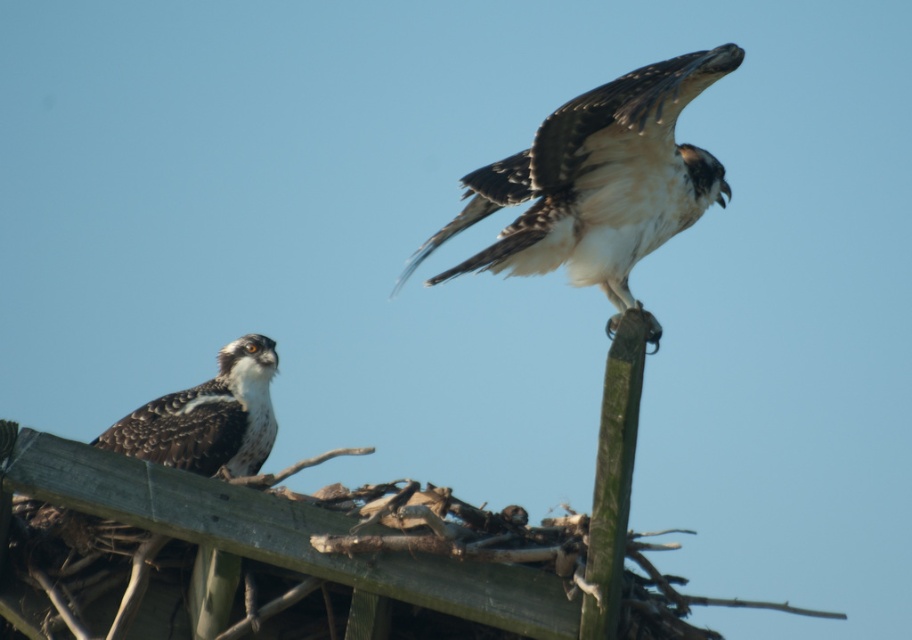
Can you confirm if white-brown feathers at upper right is bigger than dark brown speckled feathers at upper left?

Actually, white-brown feathers at upper right might be smaller than dark brown speckled feathers at upper left.

Does white-brown feathers at upper right appear on the right side of dark brown speckled feathers at upper left?

Yes, white-brown feathers at upper right is to the right of dark brown speckled feathers at upper left.

Describe the element at coordinates (600, 180) in the screenshot. I see `white-brown feathers at upper right` at that location.

This screenshot has height=640, width=912. Find the location of `white-brown feathers at upper right`. white-brown feathers at upper right is located at coordinates (600, 180).